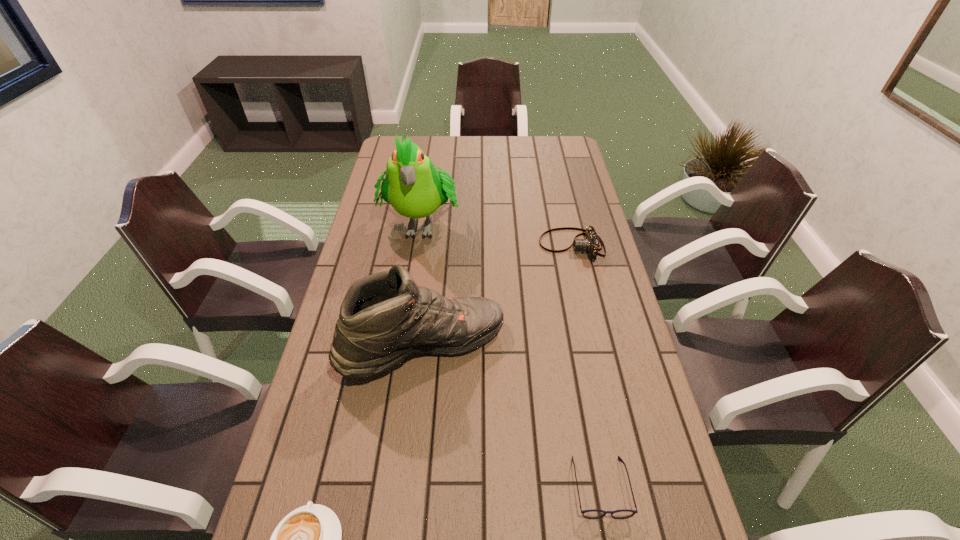
Image resolution: width=960 pixels, height=540 pixels. I want to click on vacant space that is in between the camera and the parakeet, so click(x=496, y=234).

Find the location of a particular element. This screenshot has height=540, width=960. vacant region between the tallest object and the spectacles is located at coordinates (511, 355).

Where is `free space that is in between the ski boot and the tallest object`? This screenshot has width=960, height=540. free space that is in between the ski boot and the tallest object is located at coordinates (422, 285).

Where is `free space between the third farthest object and the camera`? free space between the third farthest object and the camera is located at coordinates (497, 296).

Where is `blank region between the parakeet and the second tallest object`? The height and width of the screenshot is (540, 960). blank region between the parakeet and the second tallest object is located at coordinates (422, 285).

Where is `empty location between the spectacles and the fourth shortest object`? The width and height of the screenshot is (960, 540). empty location between the spectacles and the fourth shortest object is located at coordinates (512, 417).

Find the location of a particular element. The width and height of the screenshot is (960, 540). object that is the fourth closest to the cappuccino is located at coordinates (590, 244).

Where is `the third closest object to the spectacles`? The width and height of the screenshot is (960, 540). the third closest object to the spectacles is located at coordinates (590, 244).

This screenshot has height=540, width=960. I want to click on vacant space that satisfies the following two spatial constraints: 1. on the beak of the tallest object; 2. on the left side of the ski boot, so click(402, 347).